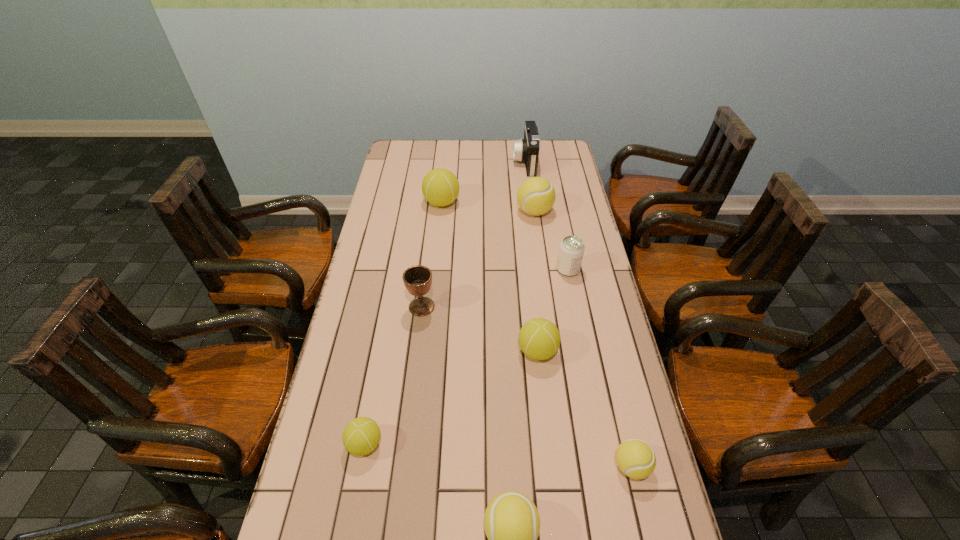
In the image, there is a desktop. Identify the location of free space at the right edge. point(623,497).

Where is `vacant point located between the rightmost tennis ball and the second farthest green tennis ball`? The image size is (960, 540). vacant point located between the rightmost tennis ball and the second farthest green tennis ball is located at coordinates (585, 408).

At what (x,y) coordinates should I click in order to perform the action: click on vacant space in between the leftmost green tennis ball and the farthest green tennis ball. Please return your answer as a coordinate pair (x, y). Looking at the image, I should click on (403, 323).

Locate an element on the screen. Image resolution: width=960 pixels, height=540 pixels. empty location between the nearest green tennis ball and the farthest green tennis ball is located at coordinates (403, 323).

Locate an element on the screen. The image size is (960, 540). free spot between the farthest yellow tennis ball and the second green tennis ball from left to right is located at coordinates (488, 207).

Identify the location of empty space between the chalice and the second green tennis ball from left to right. The image size is (960, 540). (432, 255).

You are a GUI agent. You are given a task and a screenshot of the screen. Output one action in this format:
    pyautogui.click(x=<x>, y=<y>)
    Task: Click on the vacant area between the smallest yellow tennis ball and the third farthest tennis ball
    Image resolution: width=960 pixels, height=540 pixels.
    Given the screenshot: What is the action you would take?
    pyautogui.click(x=585, y=408)

Identify the location of the second closest object to the rightmost tennis ball. The height and width of the screenshot is (540, 960). (539, 339).

Choose which object is the sixth nearest neighbor to the fifth nearest object. Please provide its 2D coordinates. Your answer should be formatted as a tuple, i.e. [(x, y)], where the tuple contains the x and y coordinates of a point satisfying the conditions above.

[(511, 522)]

This screenshot has height=540, width=960. Identify the location of the closest tennis ball to the camcorder. (536, 196).